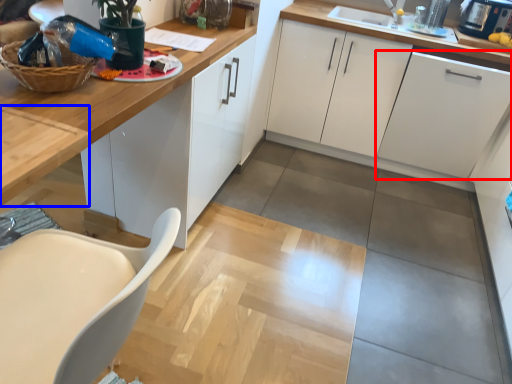
Question: Which object is closer to the camera taking this photo, cabinetry (highlighted by a red box) or table (highlighted by a blue box)?

Choices:
 (A) cabinetry
 (B) table

Answer: (B)